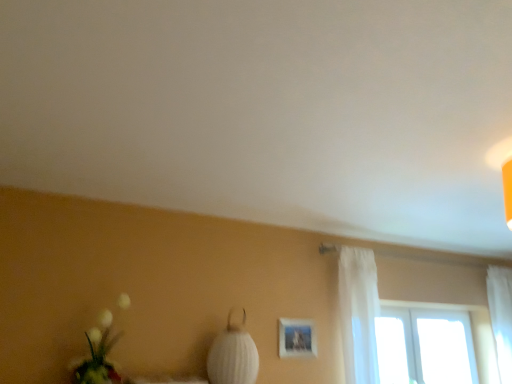
Question: From a real-world perspective, is matte white picture frame at center above or below white sheer curtain at right, which is the second curtain from left to right?

Choices:
 (A) below
 (B) above

Answer: (A)

Question: Is matte white picture frame at center in front of or behind white sheer curtain at right, the first curtain when ordered from right to left, in the image?

Choices:
 (A) front
 (B) behind

Answer: (A)

Question: Considering the real-world distances, which object is closest to the white sheer curtain at right, arranged as the 2th curtain when viewed from the right?

Choices:
 (A) white sheer curtain at right, marked as the 1th curtain in a back-to-front arrangement
 (B) white fabric lampshade at center
 (C) matte white picture frame at center
 (D) transparent glass window at upper right
 (E) white fluffy bouquet at lower left

Answer: (C)

Question: Which object is the farthest from the white fluffy bouquet at lower left?

Choices:
 (A) white sheer curtain at right, the first curtain when ordered from right to left
 (B) white sheer curtain at right, arranged as the 2th curtain when viewed from the right
 (C) transparent glass window at upper right
 (D) matte white picture frame at center
 (E) white fabric lampshade at center

Answer: (A)